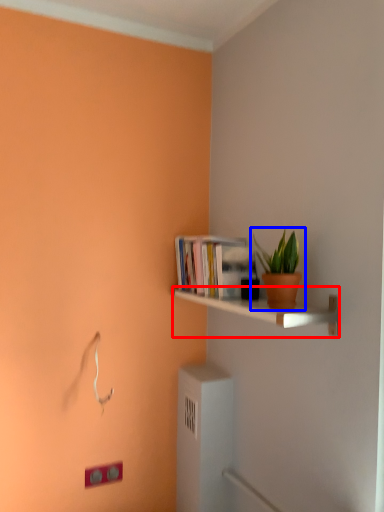
Question: Among these objects, which one is farthest to the camera, shelf (highlighted by a red box) or houseplant (highlighted by a blue box)?

Choices:
 (A) shelf
 (B) houseplant

Answer: (B)